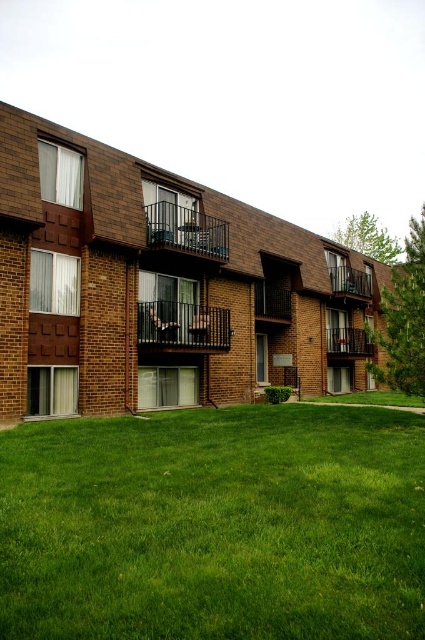
Is brown wooden balcony at upper right taller than wooden balcony at center right?

Indeed, brown wooden balcony at upper right has a greater height compared to wooden balcony at center right.

Can you confirm if brown wooden balcony at upper right is thinner than wooden balcony at center right?

Correct, brown wooden balcony at upper right's width is less than wooden balcony at center right's.

Does point (365, 273) come closer to viewer compared to point (339, 339)?

No, it is not.

Locate an element on the screen. This screenshot has width=425, height=640. brown wooden balcony at upper right is located at coordinates (350, 282).

The height and width of the screenshot is (640, 425). In order to click on black metal balcony at center in this screenshot , I will do `click(183, 324)`.

Between black metal balcony at center and wooden balcony at center right, which one is positioned higher?

black metal balcony at center

Does point (192, 307) come behind point (360, 339)?

No, (192, 307) is closer to viewer.

Find the location of a particular element. The image size is (425, 640). black metal balcony at center is located at coordinates (183, 324).

Does green grass at lower center come in front of black metal balcony at center?

Yes, it is in front of black metal balcony at center.

Between green grass at lower center and black metal balcony at center, which one has less height?

Standing shorter between the two is green grass at lower center.

Locate an element on the screen. The height and width of the screenshot is (640, 425). green grass at lower center is located at coordinates coord(215,525).